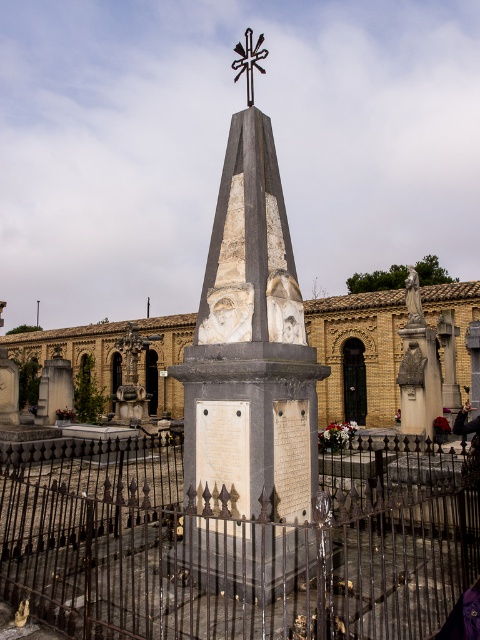
Does matte stone statue at right have a larger size compared to white marble bust at center?

Yes, matte stone statue at right is bigger than white marble bust at center.

Can you confirm if matte stone statue at right is smaller than white marble bust at center?

No.

This screenshot has height=640, width=480. What do you see at coordinates (418, 365) in the screenshot? I see `matte stone statue at right` at bounding box center [418, 365].

Find the location of `matte stone statue at right`. matte stone statue at right is located at coordinates (418, 365).

Can you confirm if black wrought iron fence at center is thinner than metallic cross at center?

No.

What do you see at coordinates (247, 554) in the screenshot?
I see `black wrought iron fence at center` at bounding box center [247, 554].

Does point (158, 516) come behind point (247, 33)?

Yes, point (158, 516) is behind point (247, 33).

Locate an element on the screen. The image size is (480, 640). black wrought iron fence at center is located at coordinates (247, 554).

Can you confirm if black wrought iron fence at center is taller than white marble bust at center?

Yes.

The height and width of the screenshot is (640, 480). Describe the element at coordinates (247, 554) in the screenshot. I see `black wrought iron fence at center` at that location.

This screenshot has height=640, width=480. Identify the location of black wrought iron fence at center. (247, 554).